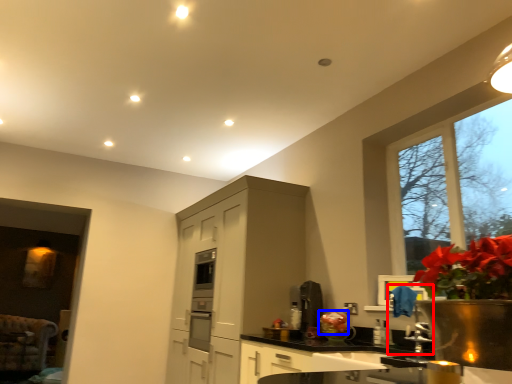
Question: Which object appears closest to the camera in this image, faucet (highlighted by a red box) or flower (highlighted by a blue box)?

Choices:
 (A) faucet
 (B) flower

Answer: (A)